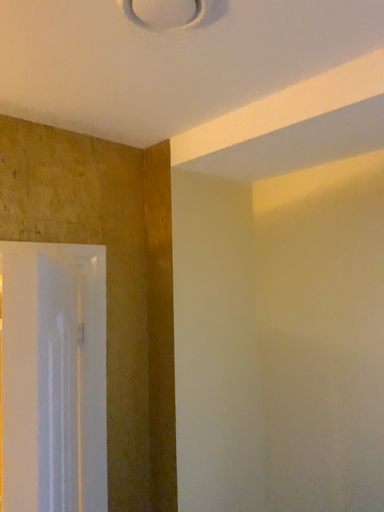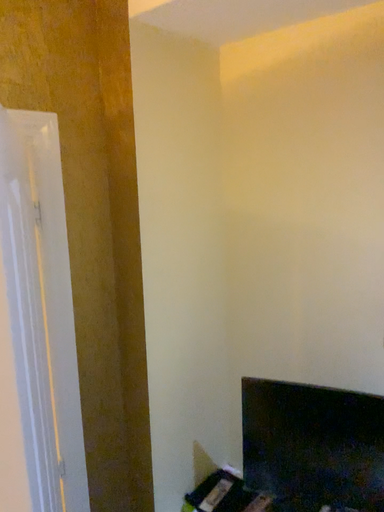
Question: Which way did the camera rotate in the video?

Choices:
 (A) rotated left
 (B) rotated right

Answer: (B)